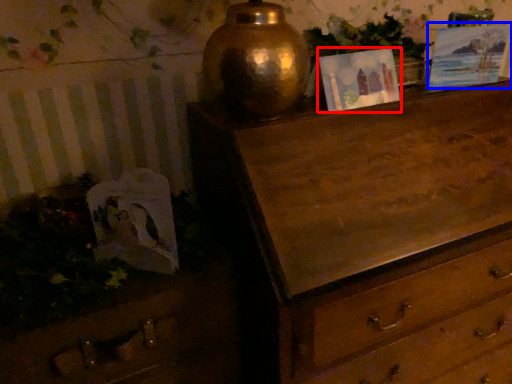
Question: Which point is closer to the camera, picture frame (highlighted by a red box) or picture frame (highlighted by a blue box)?

Choices:
 (A) picture frame
 (B) picture frame

Answer: (A)